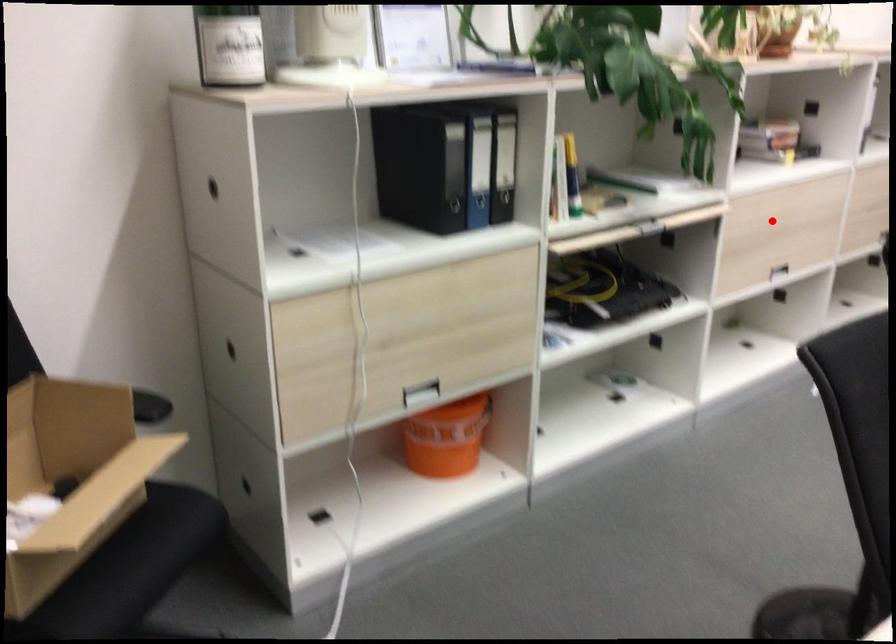
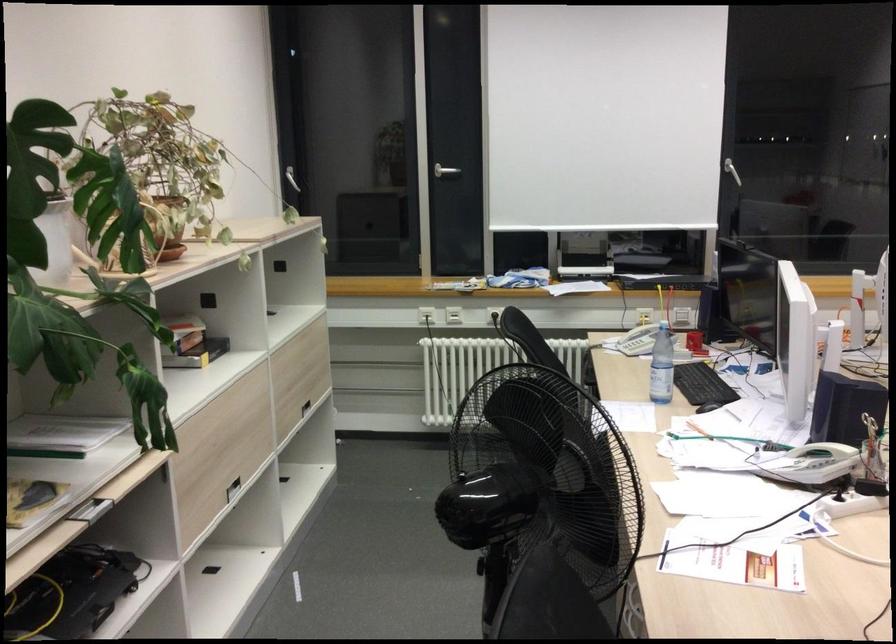
Question: I am providing you with two images of the same scene from different viewpoints. Given a red point in image1, look at the same physical point in image2. Is it:

Choices:
 (A) Closer to the viewpoint
 (B) Farther from the viewpoint

Answer: (A)